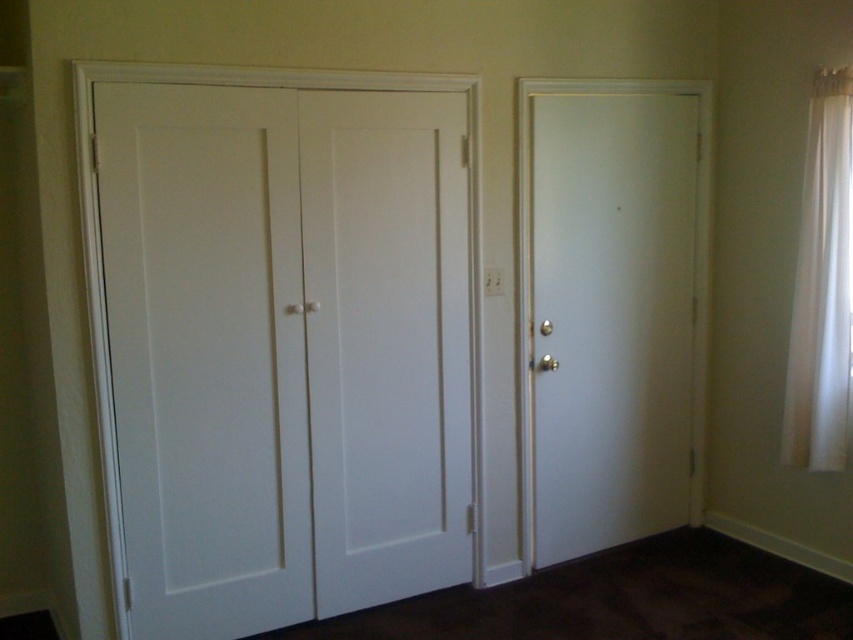
You are standing in a room and want to exit through the door. You see the white matte door at left and the white sheer curtain at right. Which one is more to the left?

The white matte door at left is more to the left.